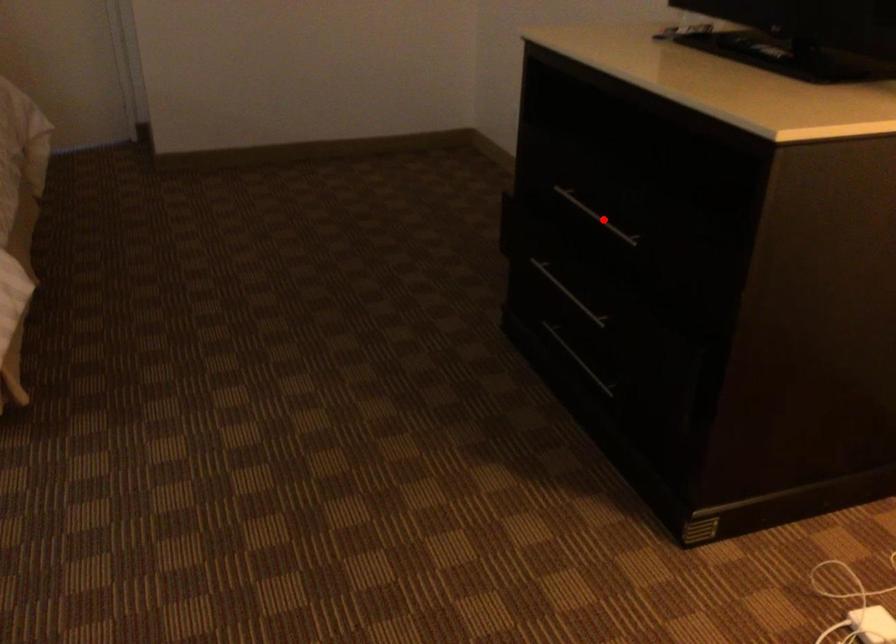
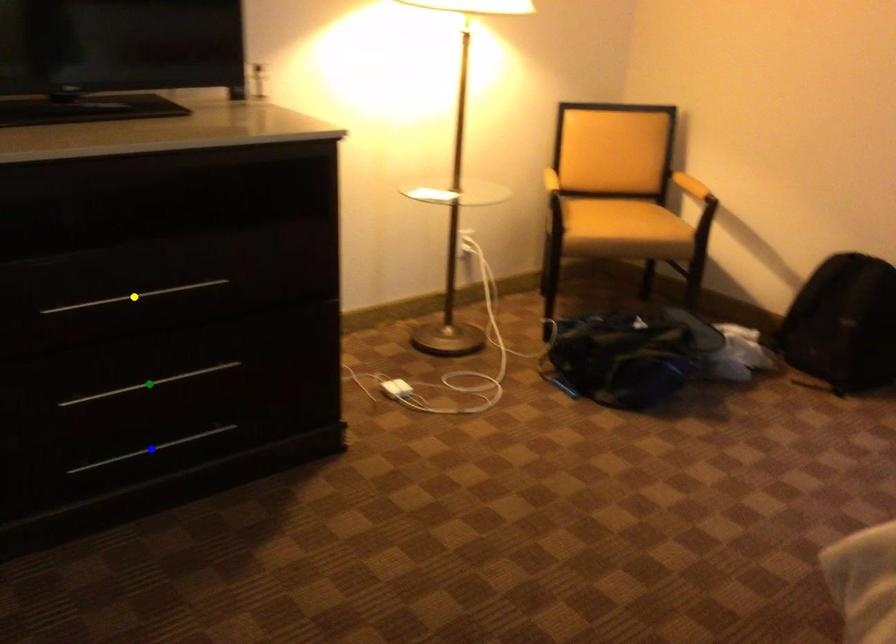
Question: I am providing you with two images of the same scene from different viewpoints. A red point is marked on the first image. You are given multiple points on the second image. Which mark in image 2 goes with the point in image 1?

Choices:
 (A) blue point
 (B) green point
 (C) yellow point

Answer: (C)